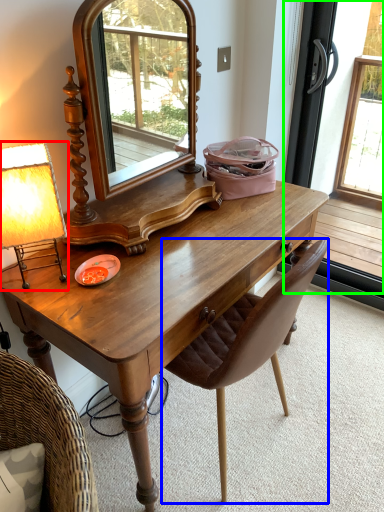
Question: Based on their relative distances, which object is nearer to table lamp (highlighted by a red box)? Choose from chair (highlighted by a blue box) and screen door (highlighted by a green box).

Choices:
 (A) chair
 (B) screen door

Answer: (A)